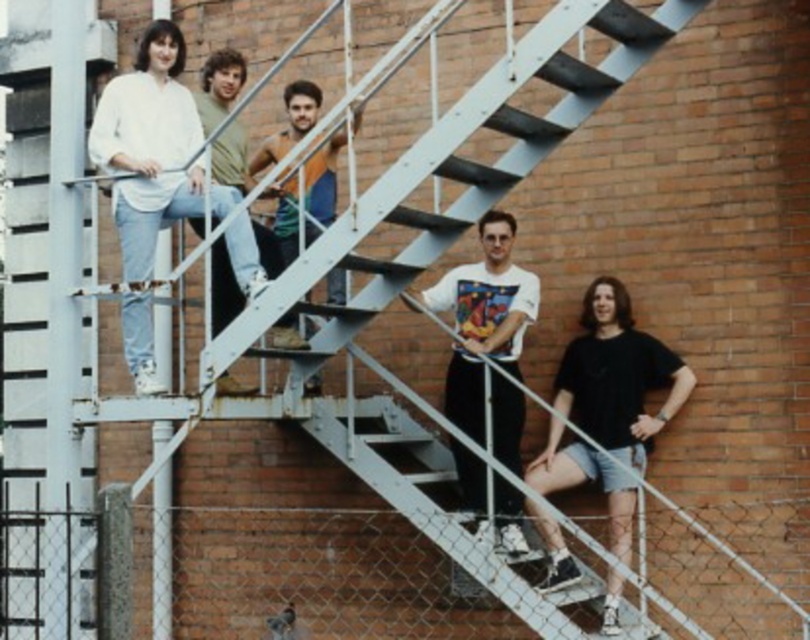
Question: Is white cotton shirt at upper left closer to camera compared to black cotton t-shirt at lower right?

Choices:
 (A) no
 (B) yes

Answer: (B)

Question: Which of the following is the farthest from the observer?

Choices:
 (A) white cotton shirt at upper left
 (B) white printed t-shirt at center
 (C) light brown denim jeans at upper center
 (D) black cotton t-shirt at lower right

Answer: (C)

Question: Can you confirm if white cotton shirt at upper left is positioned to the left of white printed t-shirt at center?

Choices:
 (A) yes
 (B) no

Answer: (A)

Question: Does black cotton t-shirt at lower right appear on the right side of light brown denim jeans at upper center?

Choices:
 (A) no
 (B) yes

Answer: (B)

Question: Among these points, which one is nearest to the camera?

Choices:
 (A) (574, 419)
 (B) (216, 152)

Answer: (A)

Question: Which point is farther to the camera?

Choices:
 (A) (486, 230)
 (B) (212, 118)
 (C) (103, 164)

Answer: (B)